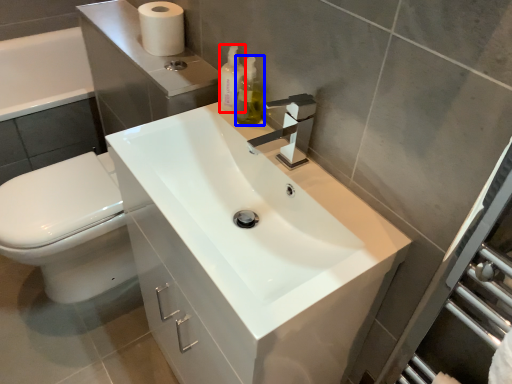
Question: Which object appears farthest to the camera in this image, soap dispenser (highlighted by a red box) or soap dispenser (highlighted by a blue box)?

Choices:
 (A) soap dispenser
 (B) soap dispenser

Answer: (A)